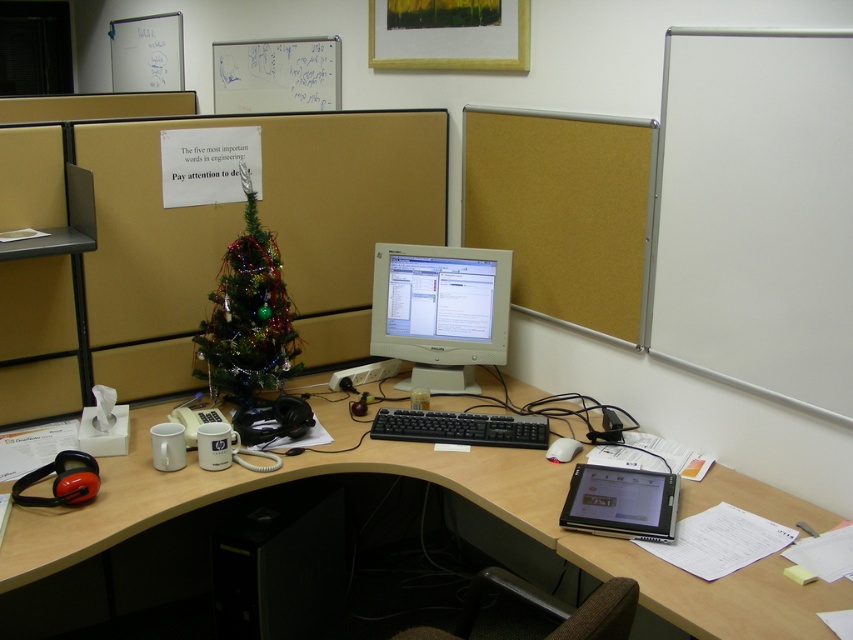
You are an office worker who needs to reach both the matte gray monitor at center and the silver metallic tablet at lower right. Which device will you have to reach further back to access?

The silver metallic tablet at lower right is behind the matte gray monitor at center, so you will have to reach further back to access the silver metallic tablet at lower right.

From the picture: You need to place a new wireless charger on the desk between the matte gray monitor at center and the silver metallic tablet at lower right. Based on their widths, will the charger fit if it requires 15 cm of space?

The matte gray monitor at center might be wider than the silver metallic tablet at lower right, but without exact measurements, it is uncertain if the 15 cm space requirement for the wireless charger can be met. Check the actual dimensions before placing it.

You are an office worker who needs to place a new wireless charger on your desk. You want it to be between the matte gray monitor at center and the silver metallic tablet at lower right. Considering their heights, which object should the charger be placed closer to?

The matte gray monitor at center is taller than the silver metallic tablet at lower right. To ensure the wireless charger is stable and doesn not block the view, it should be placed closer to the shorter object, which is the silver metallic tablet at lower right.